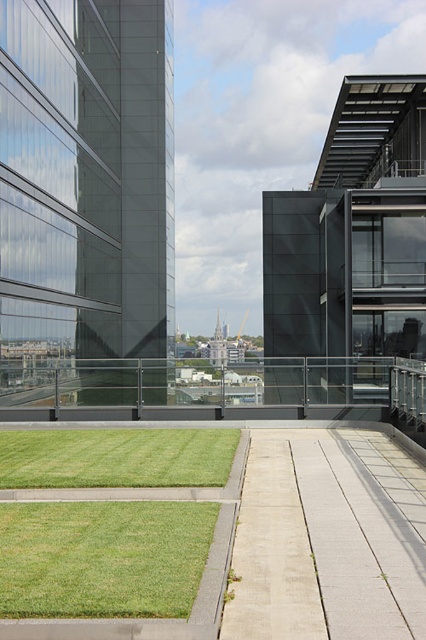
Question: Which point appears closest to the camera in this image?

Choices:
 (A) (331, 356)
 (B) (316, 468)
 (C) (120, 481)
 (D) (120, 600)

Answer: (D)

Question: Is light beige concrete pavement at center thinner than green grass at lower left?

Choices:
 (A) no
 (B) yes

Answer: (B)

Question: Which object is positioned closest to the light beige concrete pavement at center?

Choices:
 (A) green grass at lower left
 (B) black glass railing at center
 (C) green grass at center

Answer: (A)

Question: Which point is closer to the camera?

Choices:
 (A) green grass at center
 (B) black glass railing at center
 (C) green grass at lower left
 (D) light beige concrete pavement at center

Answer: (C)

Question: Can you confirm if light beige concrete pavement at center is smaller than black glass railing at center?

Choices:
 (A) yes
 (B) no

Answer: (A)

Question: Does black glass railing at center have a larger size compared to green grass at lower left?

Choices:
 (A) no
 (B) yes

Answer: (B)